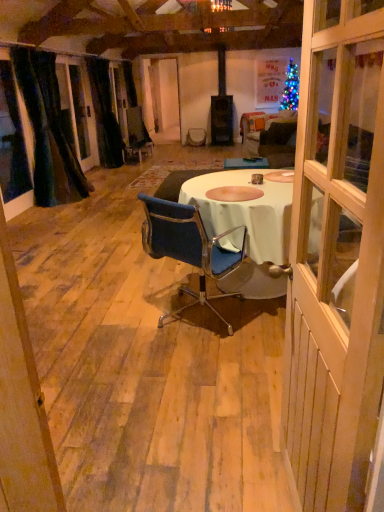
Question: Considering the relative sizes of wooden door at center and blue fabric chair at center in the image provided, is wooden door at center shorter than blue fabric chair at center?

Choices:
 (A) yes
 (B) no

Answer: (B)

Question: Is wooden door at center at the right side of blue fabric chair at center?

Choices:
 (A) yes
 (B) no

Answer: (A)

Question: Considering the relative sizes of wooden door at center and blue fabric chair at center in the image provided, is wooden door at center thinner than blue fabric chair at center?

Choices:
 (A) yes
 (B) no

Answer: (A)

Question: From a real-world perspective, is wooden door at center beneath blue fabric chair at center?

Choices:
 (A) yes
 (B) no

Answer: (B)

Question: Is wooden door at center far from blue fabric chair at center?

Choices:
 (A) yes
 (B) no

Answer: (A)

Question: Is velvety dark green curtain at left, arranged as the first curtain when viewed from the front, spatially inside black velvet curtain at left, positioned as the first curtain in back-to-front order, or outside of it?

Choices:
 (A) inside
 (B) outside

Answer: (B)

Question: Considering the positions of velvety dark green curtain at left, acting as the 2th curtain starting from the back, and black velvet curtain at left, positioned as the first curtain in back-to-front order, in the image, is velvety dark green curtain at left, acting as the 2th curtain starting from the back, taller or shorter than black velvet curtain at left, positioned as the first curtain in back-to-front order,?

Choices:
 (A) tall
 (B) short

Answer: (B)

Question: Is velvety dark green curtain at left, arranged as the first curtain when viewed from the front, wider or thinner than black velvet curtain at left, positioned as the first curtain in back-to-front order?

Choices:
 (A) wide
 (B) thin

Answer: (A)

Question: Is velvety dark green curtain at left, acting as the 2th curtain starting from the back, bigger or smaller than black velvet curtain at left, the second curtain from the front?

Choices:
 (A) big
 (B) small

Answer: (A)

Question: Is wooden door at center bigger or smaller than black velvet curtain at left, positioned as the first curtain in back-to-front order?

Choices:
 (A) big
 (B) small

Answer: (B)

Question: From the image's perspective, is wooden door at center above or below black velvet curtain at left, the second curtain from the front?

Choices:
 (A) above
 (B) below

Answer: (B)

Question: Considering the positions of wooden door at center and black velvet curtain at left, positioned as the first curtain in back-to-front order, in the image, is wooden door at center wider or thinner than black velvet curtain at left, positioned as the first curtain in back-to-front order,?

Choices:
 (A) wide
 (B) thin

Answer: (B)

Question: Does point (337, 45) appear closer or farther from the camera than point (107, 99)?

Choices:
 (A) closer
 (B) farther

Answer: (A)

Question: Is point (193, 256) closer or farther from the camera than point (59, 199)?

Choices:
 (A) closer
 (B) farther

Answer: (A)

Question: From a real-world perspective, is blue fabric chair at center physically located above or below velvety dark green curtain at left, acting as the 2th curtain starting from the back?

Choices:
 (A) above
 (B) below

Answer: (B)